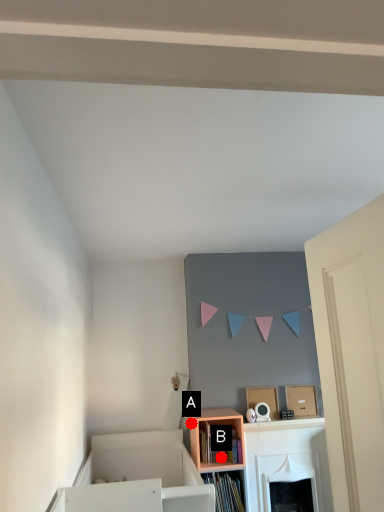
Question: Two points are circled on the image, labeled by A and B beside each circle. Which point is closer to the camera?

Choices:
 (A) A is closer
 (B) B is closer

Answer: (B)